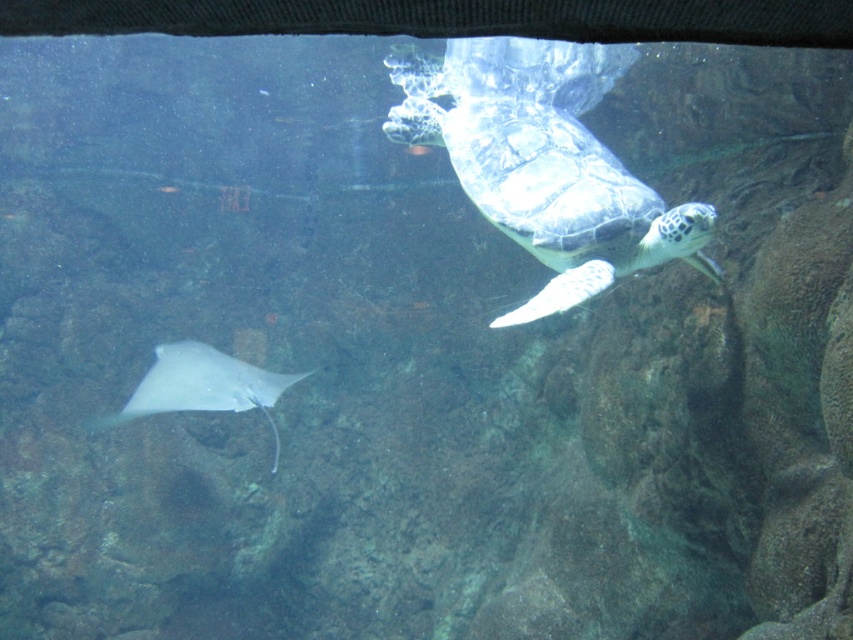
You are an aquarium visitor looking through the glass barrier. You see the smooth green turtle at upper center and the white glossy stingray at lower left. Which of these two animals is closer to you?

The smooth green turtle at upper center is closer to the viewer than the white glossy stingray at lower left.

You are an aquatic maintenance worker observing the aquarium. You notice the smooth green turtle at upper center and the white glossy stingray at lower left. Which of these two animals is positioned higher in the water column?

The smooth green turtle at upper center is positioned higher in the water column because it is much taller than the white glossy stingray at lower left.

You are an underwater explorer observing the aquarium scene. You notice two points marked in the image. From your perspective, which point is closer to you, point (646, 189) or point (206, 378)?

Point (646, 189) is in front of point (206, 378), so it is closer to you.